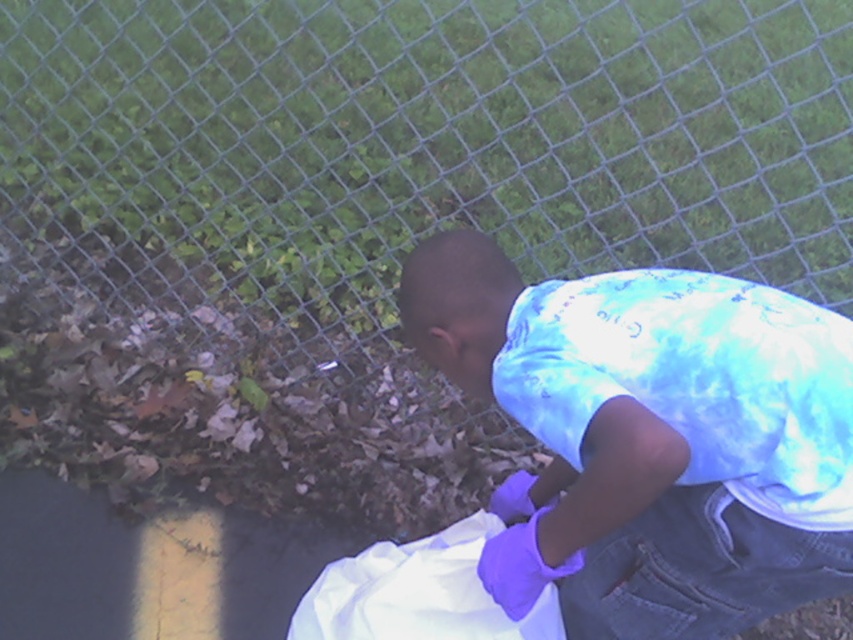
Question: Is metallic chain-link fence at upper center in front of blue tie-dye shirt at center?

Choices:
 (A) yes
 (B) no

Answer: (B)

Question: Is metallic chain-link fence at upper center closer to camera compared to blue tie-dye shirt at center?

Choices:
 (A) yes
 (B) no

Answer: (B)

Question: Which object appears closest to the camera in this image?

Choices:
 (A) metallic chain-link fence at upper center
 (B) blue tie-dye shirt at center

Answer: (B)

Question: Which object is closer to the camera taking this photo?

Choices:
 (A) blue tie-dye shirt at center
 (B) metallic chain-link fence at upper center

Answer: (A)

Question: Is metallic chain-link fence at upper center further to camera compared to blue tie-dye shirt at center?

Choices:
 (A) no
 (B) yes

Answer: (B)